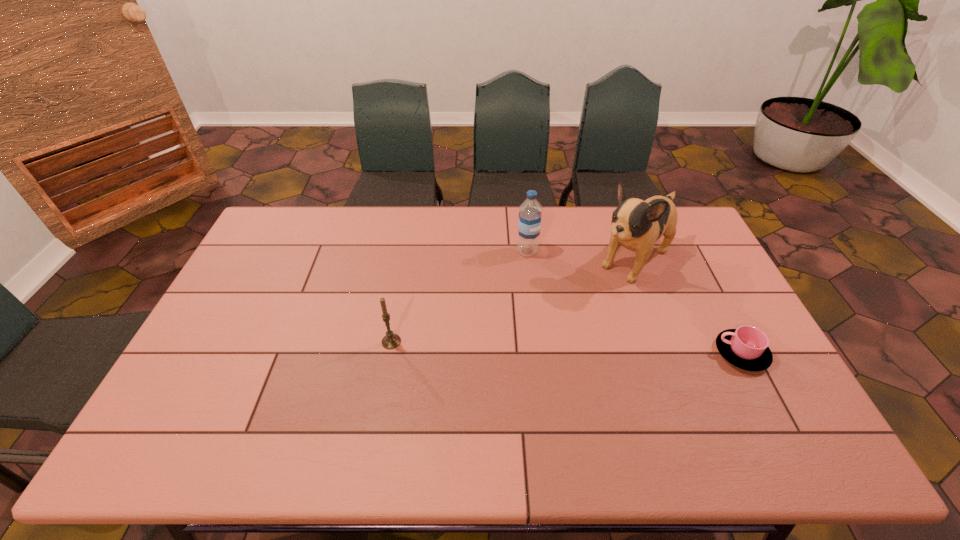
You are a GUI agent. You are given a task and a screenshot of the screen. Output one action in this format:
    pyautogui.click(x=<x>, y=<y>)
    Task: Click on the object positioned at the far right corner
    The height and width of the screenshot is (540, 960).
    Given the screenshot: What is the action you would take?
    pyautogui.click(x=636, y=224)

At what (x,y) coordinates should I click in order to perform the action: click on free space at the far edge of the desktop. Please return your answer as a coordinate pair (x, y). Looking at the image, I should click on (564, 224).

Identify the location of free space at the near edge. (234, 401).

At what (x,y) coordinates should I click in order to perform the action: click on free spot at the left edge of the desktop. Please return your answer as a coordinate pair (x, y). The width and height of the screenshot is (960, 540). Looking at the image, I should click on (270, 290).

Where is `free space at the right edge of the desktop`? The image size is (960, 540). free space at the right edge of the desktop is located at coordinates (672, 267).

Image resolution: width=960 pixels, height=540 pixels. In the image, there is a desktop. Find the location of `blank space at the far left corner`. blank space at the far left corner is located at coordinates (297, 237).

Image resolution: width=960 pixels, height=540 pixels. I want to click on vacant region between the shortest object and the second shortest object, so click(566, 347).

Locate an element on the screen. The width and height of the screenshot is (960, 540). vacant point located between the candle and the tallest object is located at coordinates (513, 300).

Where is `free area in between the cup and the tallest object`? Image resolution: width=960 pixels, height=540 pixels. free area in between the cup and the tallest object is located at coordinates (687, 306).

This screenshot has height=540, width=960. Identify the location of empty space between the puppy and the shortest object. (687, 306).